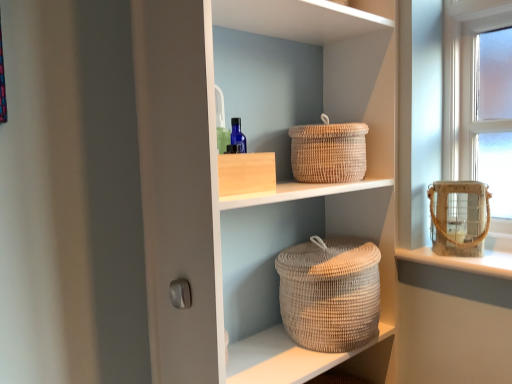
Question: Is neutral woven basket at center, which is counted as the 2th basket container, starting from the right, bigger or smaller than natural woven basket at center?

Choices:
 (A) big
 (B) small

Answer: (B)

Question: From a real-world perspective, relative to natural woven basket at center, is neutral woven basket at center, which is the first basket container from left to right, vertically above or below?

Choices:
 (A) above
 (B) below

Answer: (B)

Question: Considering the real-world distances, which object is farthest from the natural woven basket at upper center?

Choices:
 (A) rustic woven basket at right, the 2th basket container when ordered from bottom to top
 (B) white glossy door handle at lower left
 (C) neutral woven basket at center, marked as the 1th basket container in a bottom-to-top arrangement
 (D) natural woven basket at center

Answer: (B)

Question: Which object is positioned farthest from the white glossy door handle at lower left?

Choices:
 (A) neutral woven basket at center, positioned as the second basket container in top-to-bottom order
 (B) natural woven basket at center
 (C) natural woven basket at upper center
 (D) rustic woven basket at right, the 2th basket container when ordered from bottom to top

Answer: (D)